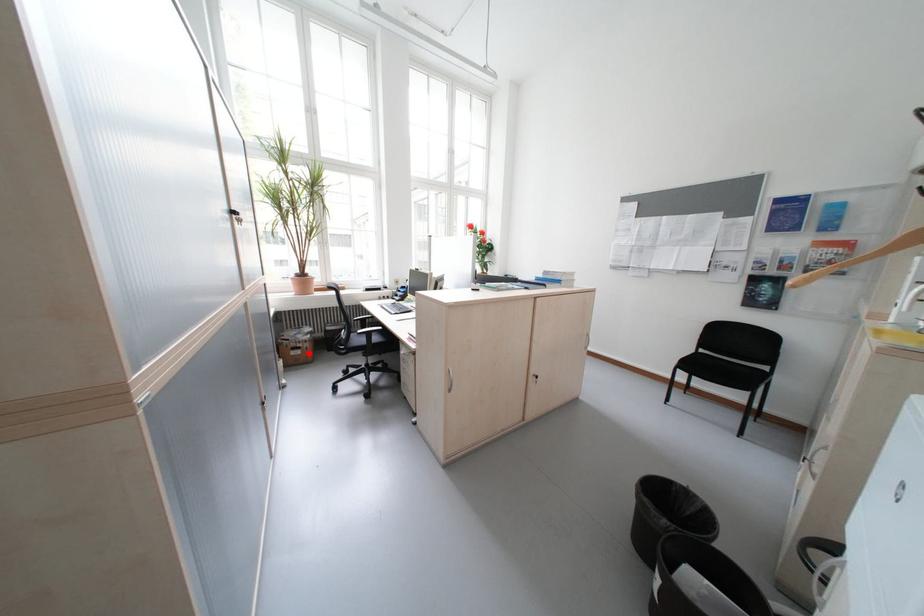
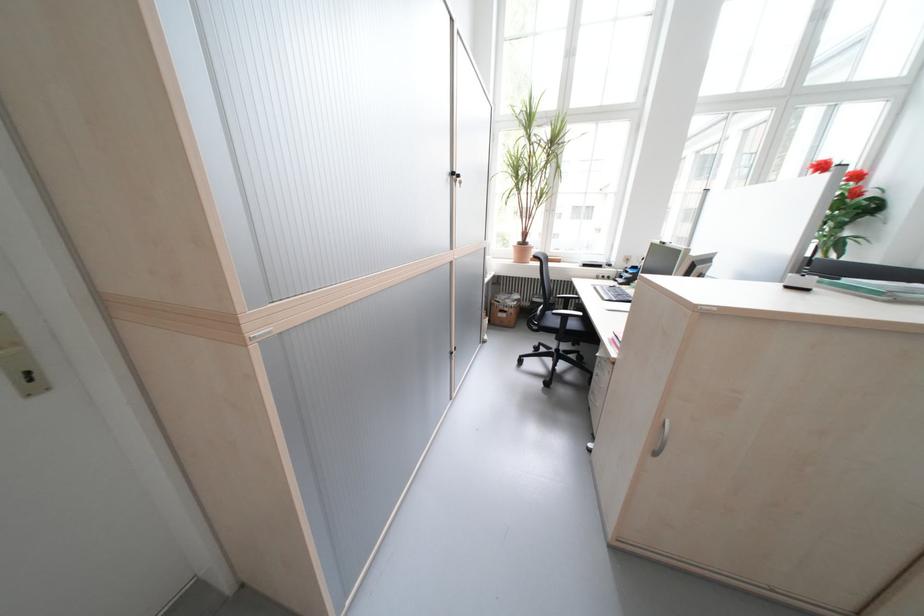
Question: I am providing you with two images of the same scene from different viewpoints. Image1 has a red point marked. In image2, the corresponding 3D location appears at what relative position? Reply with the corresponding letter.

Choices:
 (A) Closer
 (B) Farther

Answer: (A)